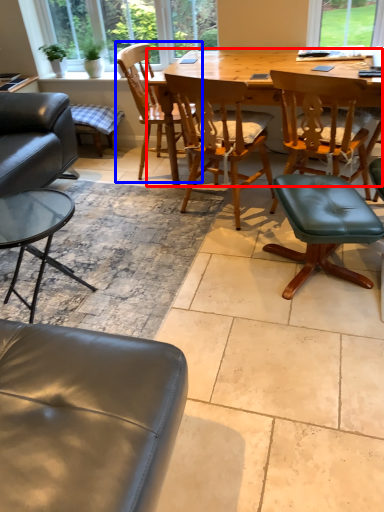
Question: Which point is closer to the camera, kitchen & dining room table (highlighted by a red box) or chair (highlighted by a blue box)?

Choices:
 (A) kitchen & dining room table
 (B) chair

Answer: (A)